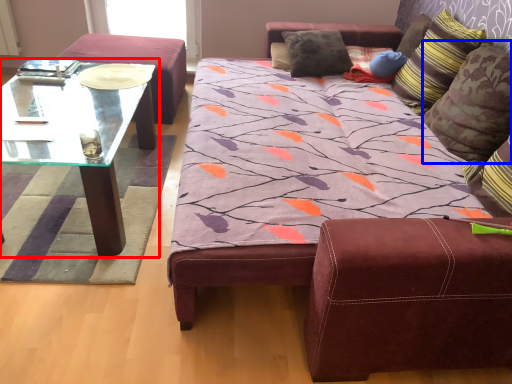
Question: Which object appears closest to the camera in this image, coffee table (highlighted by a red box) or pillow (highlighted by a blue box)?

Choices:
 (A) coffee table
 (B) pillow

Answer: (B)